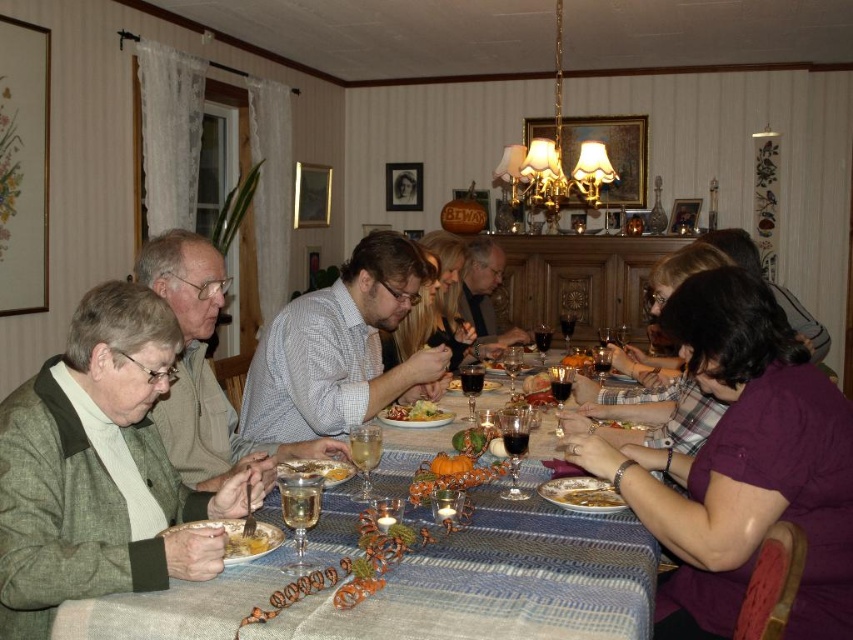
From the picture: Who is higher up, purple matte shirt at lower right or white porcelain bowl at center?

purple matte shirt at lower right is higher up.

Is purple matte shirt at lower right above white porcelain bowl at center?

Indeed, purple matte shirt at lower right is positioned over white porcelain bowl at center.

This screenshot has height=640, width=853. Find the location of `purple matte shirt at lower right`. purple matte shirt at lower right is located at coordinates (741, 467).

Does green knitted sweater at lower left have a lesser height compared to yellow matte plate at lower left?

Incorrect, green knitted sweater at lower left's height does not fall short of yellow matte plate at lower left's.

Does point (51, 481) come farther from viewer compared to point (229, 536)?

That is False.

What do you see at coordinates (100, 468) in the screenshot?
I see `green knitted sweater at lower left` at bounding box center [100, 468].

Find the location of `green knitted sweater at lower left`. green knitted sweater at lower left is located at coordinates (100, 468).

Between point (289, 348) and point (572, 353), which one is positioned behind?

Point (572, 353)

Consider the image. Is checkered fabric shirt at center taller than smooth pumpkin at center?

Correct, checkered fabric shirt at center is much taller as smooth pumpkin at center.

Between point (399, 365) and point (583, 356), which one is positioned behind?

The point (583, 356) is more distant.

The width and height of the screenshot is (853, 640). I want to click on checkered fabric shirt at center, so click(x=339, y=348).